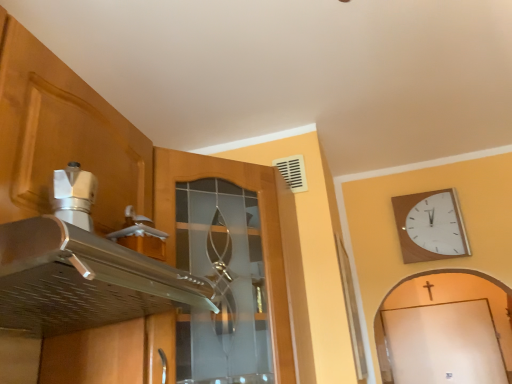
Question: Is silver metallic exhaust hood at upper left oriented towards matte wood cabinet at upper left?

Choices:
 (A) no
 (B) yes

Answer: (A)

Question: From a real-world perspective, is silver metallic exhaust hood at upper left under matte wood cabinet at upper left?

Choices:
 (A) no
 (B) yes

Answer: (B)

Question: Can you see silver metallic exhaust hood at upper left touching matte wood cabinet at upper left?

Choices:
 (A) yes
 (B) no

Answer: (B)

Question: Considering the relative sizes of silver metallic exhaust hood at upper left and matte wood cabinet at upper left in the image provided, is silver metallic exhaust hood at upper left thinner than matte wood cabinet at upper left?

Choices:
 (A) no
 (B) yes

Answer: (B)

Question: Considering the relative sizes of silver metallic exhaust hood at upper left and matte wood cabinet at upper left in the image provided, is silver metallic exhaust hood at upper left bigger than matte wood cabinet at upper left?

Choices:
 (A) no
 (B) yes

Answer: (A)

Question: From their relative heights in the image, would you say wooden wall clock at upper right is taller or shorter than matte wood cabinet at upper left?

Choices:
 (A) tall
 (B) short

Answer: (B)

Question: Is point (421, 193) positioned closer to the camera than point (204, 173)?

Choices:
 (A) closer
 (B) farther

Answer: (B)

Question: Visually, is wooden wall clock at upper right positioned to the left or to the right of matte wood cabinet at upper left?

Choices:
 (A) right
 (B) left

Answer: (A)

Question: Would you say wooden wall clock at upper right is inside or outside matte wood cabinet at upper left?

Choices:
 (A) outside
 (B) inside

Answer: (A)

Question: Would you say matte wood cabinet at upper left is to the left or to the right of wooden wall clock at upper right in the picture?

Choices:
 (A) right
 (B) left

Answer: (B)

Question: Do you think matte wood cabinet at upper left is within wooden wall clock at upper right, or outside of it?

Choices:
 (A) inside
 (B) outside

Answer: (B)

Question: Is matte wood cabinet at upper left wider or thinner than wooden wall clock at upper right?

Choices:
 (A) wide
 (B) thin

Answer: (A)

Question: Considering the positions of matte wood cabinet at upper left and wooden wall clock at upper right in the image, is matte wood cabinet at upper left taller or shorter than wooden wall clock at upper right?

Choices:
 (A) tall
 (B) short

Answer: (A)

Question: Would you say matte wood cabinet at upper left is to the left or to the right of silver metallic exhaust hood at upper left in the picture?

Choices:
 (A) left
 (B) right

Answer: (B)

Question: From the image's perspective, is matte wood cabinet at upper left positioned above or below silver metallic exhaust hood at upper left?

Choices:
 (A) above
 (B) below

Answer: (B)